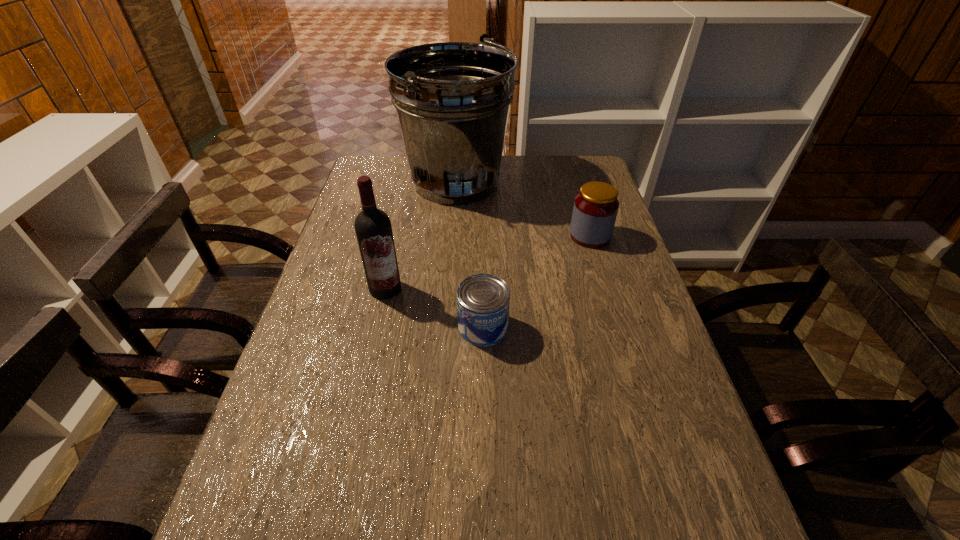
In the image, there is a desktop. Find the location of `vacant area at the far right corner`. vacant area at the far right corner is located at coordinates (580, 185).

I want to click on blank region between the tallest object and the second nearest object, so click(420, 236).

In order to click on free space that is in between the third shortest object and the shortest object in this screenshot , I will do `click(434, 308)`.

You are a GUI agent. You are given a task and a screenshot of the screen. Output one action in this format:
    pyautogui.click(x=<x>, y=<y>)
    Task: Click on the vacant space that is in between the nearest object and the third nearest object
    
    Given the screenshot: What is the action you would take?
    pyautogui.click(x=537, y=281)

The height and width of the screenshot is (540, 960). What are the coordinates of `free spot between the farthest object and the second nearest object` in the screenshot? It's located at (420, 236).

You are a GUI agent. You are given a task and a screenshot of the screen. Output one action in this format:
    pyautogui.click(x=<x>, y=<y>)
    Task: Click on the free spot between the wine bottle and the can
    
    Given the screenshot: What is the action you would take?
    pyautogui.click(x=434, y=308)

Where is `vacant area between the second nearest object and the second farthest object`? This screenshot has height=540, width=960. vacant area between the second nearest object and the second farthest object is located at coordinates (488, 262).

Identify the location of free space between the nearest object and the second nearest object. The image size is (960, 540). (434, 308).

The width and height of the screenshot is (960, 540). I want to click on vacant area between the rightmost object and the bucket, so click(x=523, y=210).

I want to click on empty location between the nearest object and the wine bottle, so click(x=434, y=308).